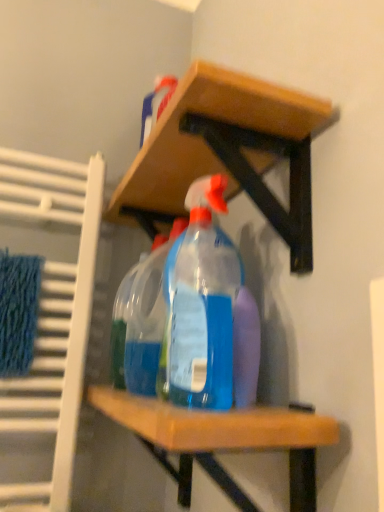
Question: In terms of size, does blue knitted bath towel at left appear bigger or smaller than transparent plastic spray bottle at center, which ranks as the 1th bottle in back-to-front order?

Choices:
 (A) big
 (B) small

Answer: (B)

Question: Is point (11, 260) closer or farther from the camera than point (147, 379)?

Choices:
 (A) closer
 (B) farther

Answer: (B)

Question: Based on their relative distances, which object is farther from the wooden shelf at upper center?

Choices:
 (A) blue knitted bath towel at left
 (B) transparent plastic spray bottle at center, which ranks as the 1th bottle in back-to-front order
 (C) transparent plastic spray bottle at center, marked as the first bottle in a front-to-back arrangement

Answer: (A)

Question: Estimate the real-world distances between objects in this image. Which object is farther from the wooden shelf at upper center?

Choices:
 (A) transparent plastic spray bottle at center, which appears as the second bottle when viewed from the back
 (B) transparent plastic spray bottle at center, which ranks as the 1th bottle in back-to-front order
 (C) blue knitted bath towel at left

Answer: (C)